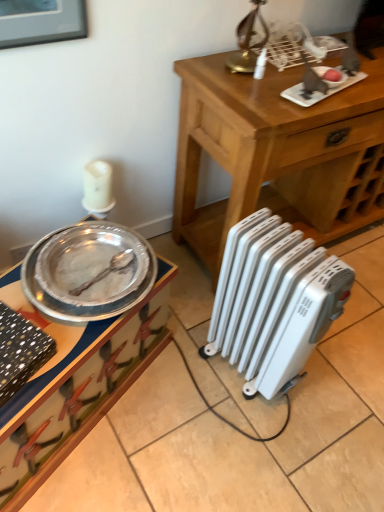
Locate an element on the screen. vacant space in front of white plastic radiator at lower right is located at coordinates (254, 441).